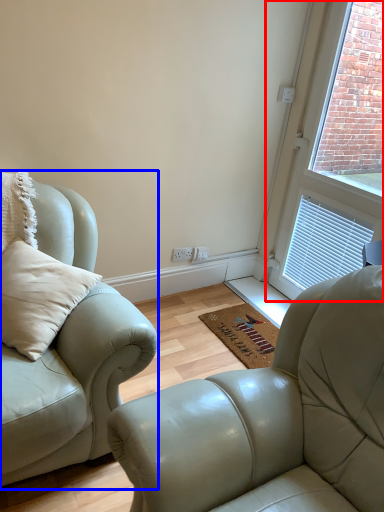
Question: Which object appears farthest to the camera in this image, window (highlighted by a red box) or studio couch (highlighted by a blue box)?

Choices:
 (A) window
 (B) studio couch

Answer: (A)